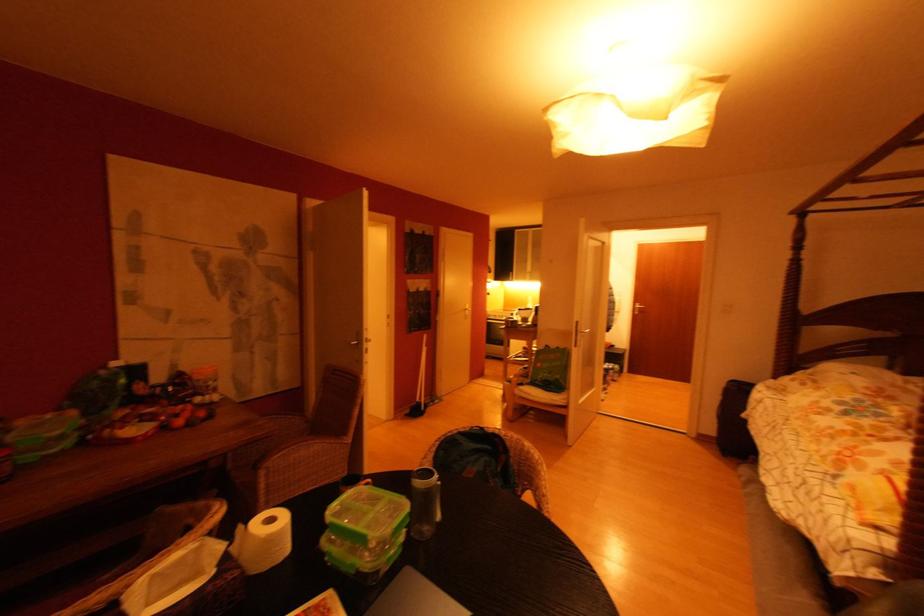
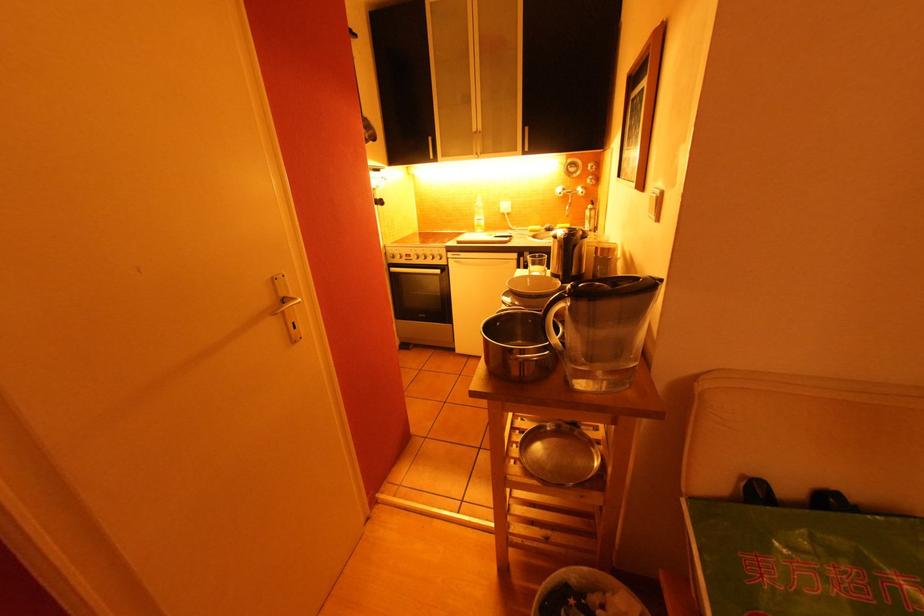
Locate, in the second image, the point that corresponds to the point at 494,317 in the first image.

(398, 259)